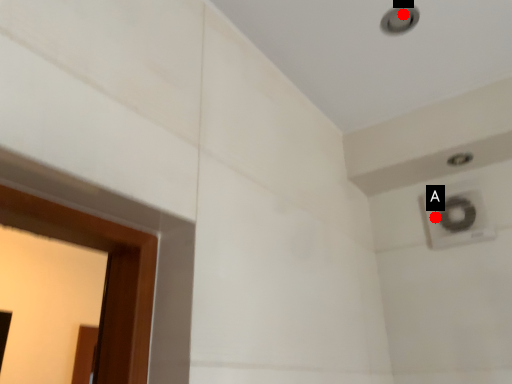
Question: Two points are circled on the image, labeled by A and B beside each circle. Which point appears farthest from the camera in this image?

Choices:
 (A) A is further
 (B) B is further

Answer: (A)